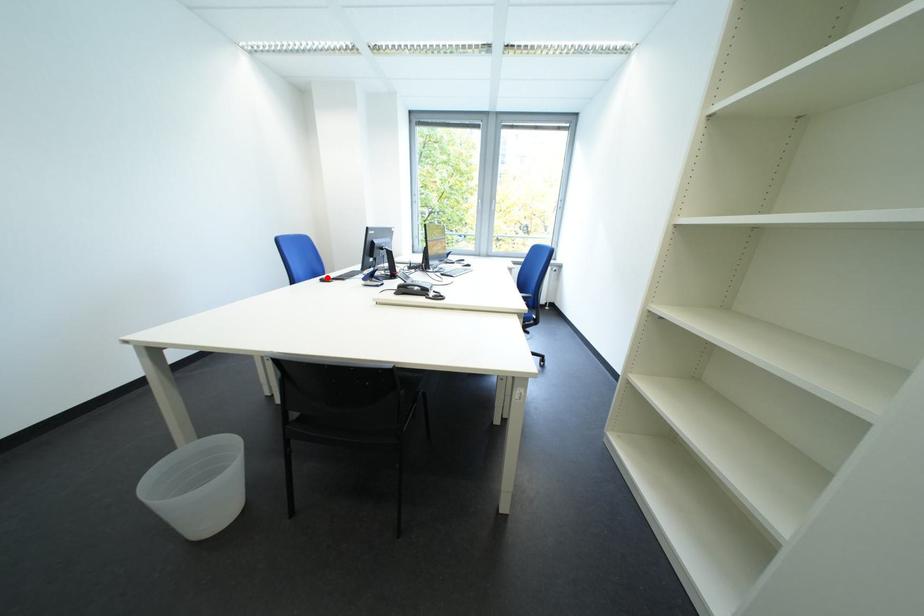
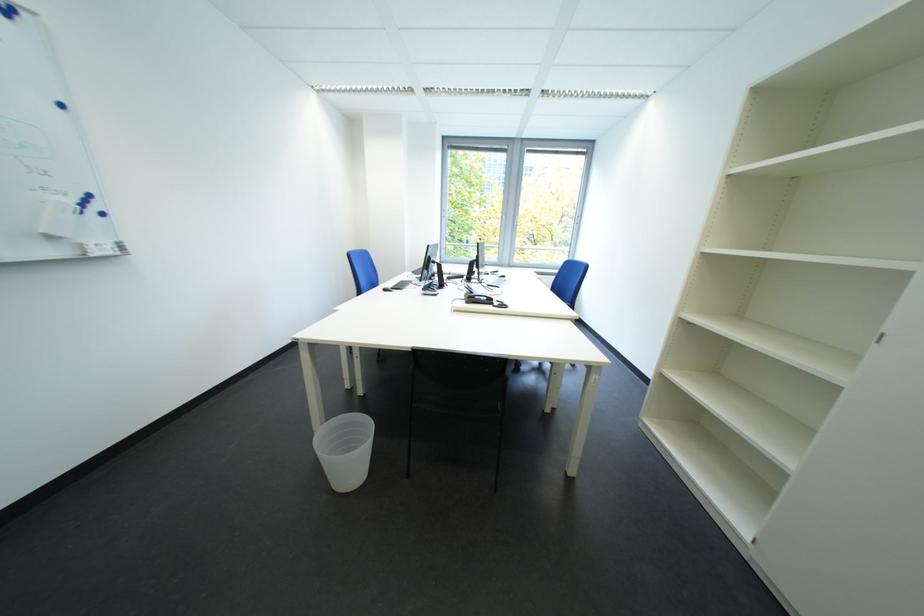
In the second image, find the point that corresponds to the highlighted location in the first image.

(385, 286)